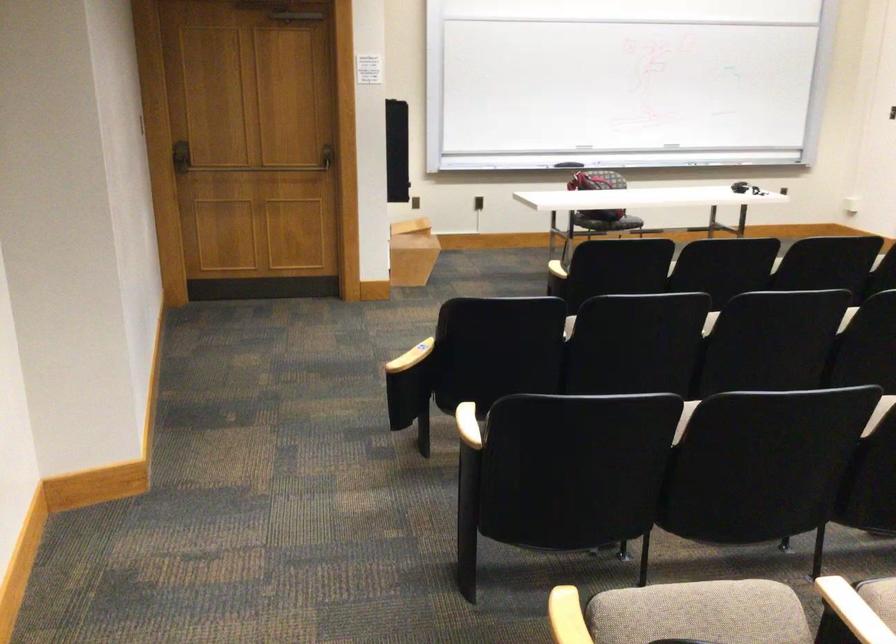
Find where to lift the cardboard box. Please return your answer as a coordinate pair (x, y).

(411, 252)